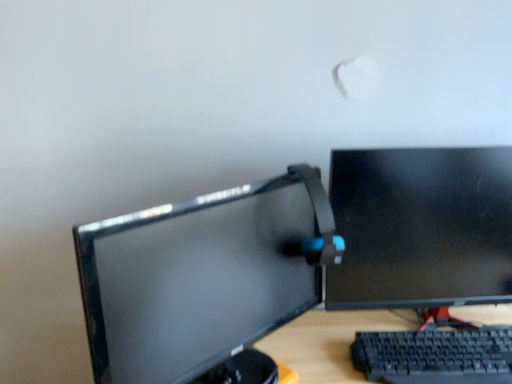
Question: Is black glossy monitor at right, which appears as the 2th computer monitor when viewed from the left, wider than black plastic keyboard at lower right?

Choices:
 (A) no
 (B) yes

Answer: (A)

Question: Can you confirm if black glossy monitor at right, the 1th computer monitor in the right-to-left sequence, is bigger than black plastic keyboard at lower right?

Choices:
 (A) no
 (B) yes

Answer: (B)

Question: From a real-world perspective, is black glossy monitor at right, which appears as the 2th computer monitor when viewed from the left, physically below black plastic keyboard at lower right?

Choices:
 (A) no
 (B) yes

Answer: (A)

Question: Is black glossy monitor at right, the 1th computer monitor in the right-to-left sequence, in contact with black plastic keyboard at lower right?

Choices:
 (A) no
 (B) yes

Answer: (A)

Question: Is there a large distance between black glossy monitor at right, the 1th computer monitor in the right-to-left sequence, and black plastic keyboard at lower right?

Choices:
 (A) yes
 (B) no

Answer: (B)

Question: Does point (478, 374) appear closer or farther from the camera than point (474, 152)?

Choices:
 (A) closer
 (B) farther

Answer: (A)

Question: Looking at their shapes, would you say black plastic keyboard at lower right is wider or thinner than black glossy monitor at right, the 1th computer monitor in the right-to-left sequence?

Choices:
 (A) thin
 (B) wide

Answer: (B)

Question: In terms of height, does black plastic keyboard at lower right look taller or shorter compared to black glossy monitor at right, which appears as the 2th computer monitor when viewed from the left?

Choices:
 (A) short
 (B) tall

Answer: (A)

Question: From a real-world perspective, is black plastic keyboard at lower right above or below black glossy monitor at right, the 1th computer monitor in the right-to-left sequence?

Choices:
 (A) below
 (B) above

Answer: (A)

Question: Does point (387, 304) appear closer or farther from the camera than point (207, 319)?

Choices:
 (A) closer
 (B) farther

Answer: (B)

Question: Based on their positions, is black glossy monitor at right, which appears as the 2th computer monitor when viewed from the left, located to the left or right of matte black monitor at center, which appears as the first computer monitor when viewed from the left?

Choices:
 (A) left
 (B) right

Answer: (B)

Question: Is black glossy monitor at right, which appears as the 2th computer monitor when viewed from the left, inside the boundaries of matte black monitor at center, which appears as the first computer monitor when viewed from the left, or outside?

Choices:
 (A) inside
 (B) outside

Answer: (B)

Question: In terms of size, does black glossy monitor at right, the 1th computer monitor in the right-to-left sequence, appear bigger or smaller than matte black monitor at center, arranged as the second computer monitor when viewed from the right?

Choices:
 (A) small
 (B) big

Answer: (A)

Question: Would you say matte black monitor at center, which appears as the first computer monitor when viewed from the left, is inside or outside black plastic keyboard at lower right?

Choices:
 (A) inside
 (B) outside

Answer: (B)

Question: From a real-world perspective, is matte black monitor at center, which appears as the first computer monitor when viewed from the left, positioned above or below black plastic keyboard at lower right?

Choices:
 (A) above
 (B) below

Answer: (A)